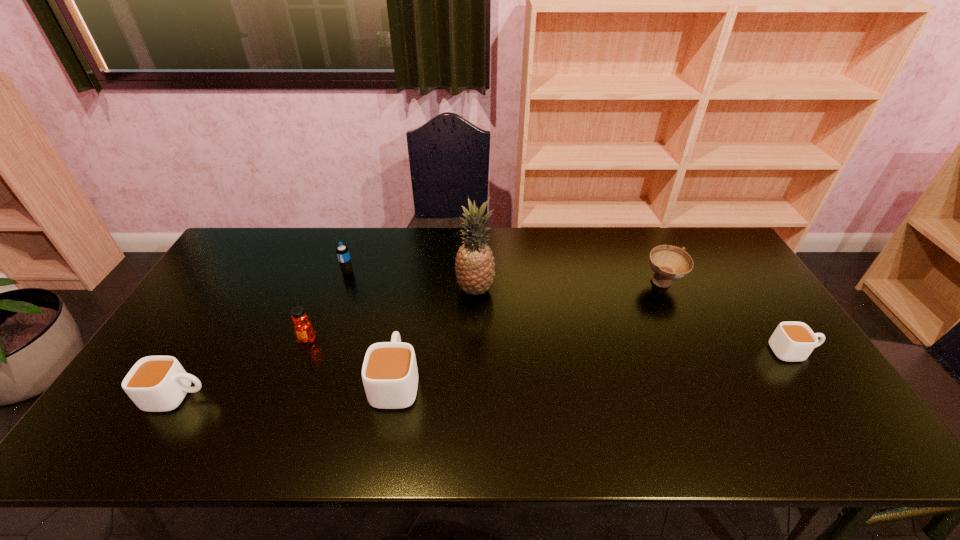
Please point a spot to place another cup for symmetrical spacing. Please provide its 2D coordinates. Your answer should be formatted as a tuple, i.e. [(x, y)], where the tuple contains the x and y coordinates of a point satisfying the conditions above.

[(601, 366)]